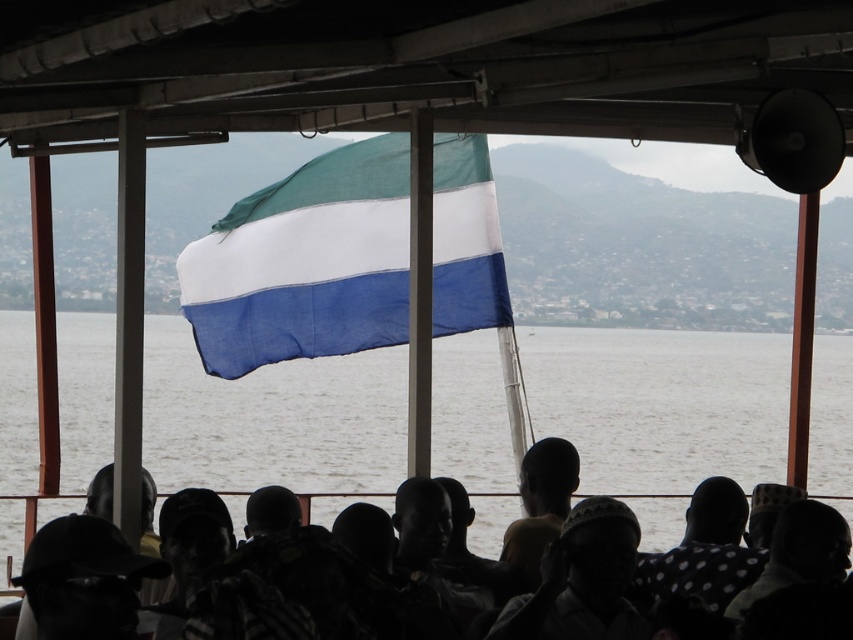
You are a photographer trying to capture the silhouette headscarf at center and the textured fabric flag at center in the same frame. Which object should you focus on first if you want to ensure both are in focus, considering their distances from the camera?

The textured fabric flag at center is taller than the silhouette headscarf at center, so focusing on the textured fabric flag at center first will help ensure both are in focus since it is closer to the camera.